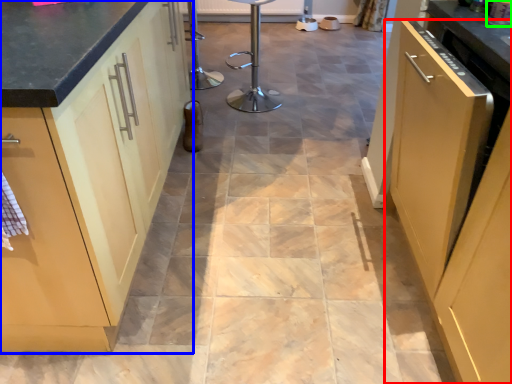
Question: Which is nearer to the cabinetry (highlighted by a red box)? cabinetry (highlighted by a blue box) or appliance (highlighted by a green box).

Choices:
 (A) cabinetry
 (B) appliance

Answer: (B)